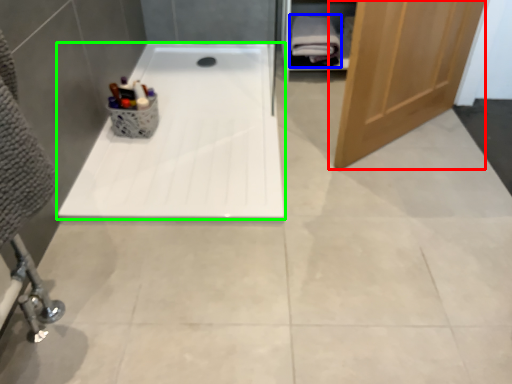
Question: Which object is the farthest from door (highlighted by a red box)? Choose among these: bath towel (highlighted by a blue box) or bathtub (highlighted by a green box).

Choices:
 (A) bath towel
 (B) bathtub

Answer: (A)